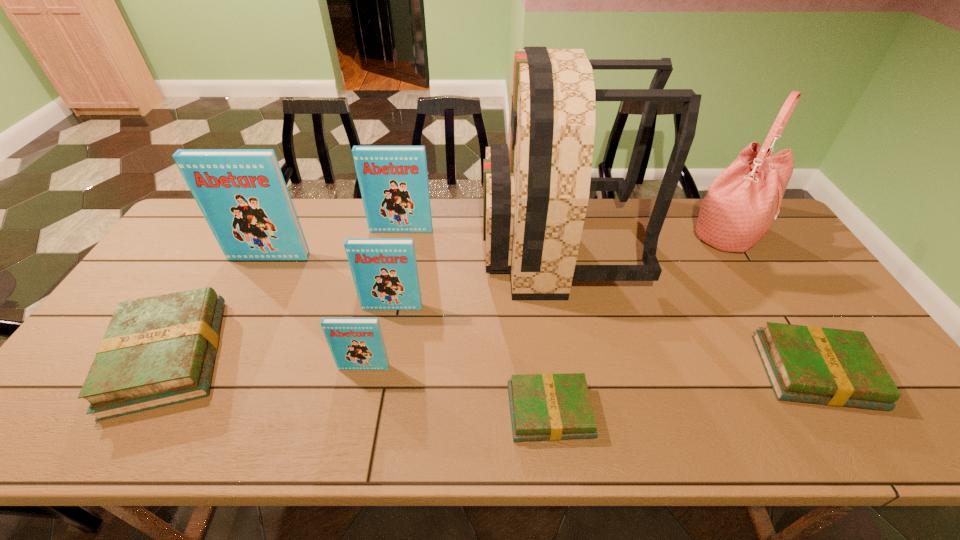
I want to click on free spot between the nearest blue book and the second farthest blue book, so click(x=317, y=312).

At what (x,y) coordinates should I click in order to perform the action: click on vacant area that lies between the eighth tallest object and the second smallest blue book. Please return your answer as a coordinate pair (x, y). Looking at the image, I should click on (604, 340).

The width and height of the screenshot is (960, 540). I want to click on vacant area that lies between the shortest book and the biggest yellow book, so click(x=359, y=383).

Identify the location of free space between the shortest book and the sixth tallest book. The image size is (960, 540). (683, 392).

In order to click on vacant area between the second biggest blue book and the third shortest object in this screenshot , I will do `click(285, 293)`.

You are a GUI agent. You are given a task and a screenshot of the screen. Output one action in this format:
    pyautogui.click(x=<x>, y=<y>)
    Task: Click on the vacant space that's between the third shortest book and the fourth shortest object
    
    Given the screenshot: What is the action you would take?
    pyautogui.click(x=266, y=362)

You are a GUI agent. You are given a task and a screenshot of the screen. Output one action in this format:
    pyautogui.click(x=<x>, y=<y>)
    Task: Click on the empty space that is in between the second biggest blue book and the backpack
    
    Given the screenshot: What is the action you would take?
    pyautogui.click(x=479, y=238)

I want to click on free space that is in between the smallest yellow book and the handbag, so click(637, 322).

At what (x,y) coordinates should I click in order to perform the action: click on the fourth closest object to the third tallest book. Please return your answer as a coordinate pair (x, y). The height and width of the screenshot is (540, 960). Looking at the image, I should click on (157, 351).

Point out which object is positioned as the fourth nearest to the leftmost blue book. Please provide its 2D coordinates. Your answer should be formatted as a tuple, i.e. [(x, y)], where the tuple contains the x and y coordinates of a point satisfying the conditions above.

[(356, 343)]